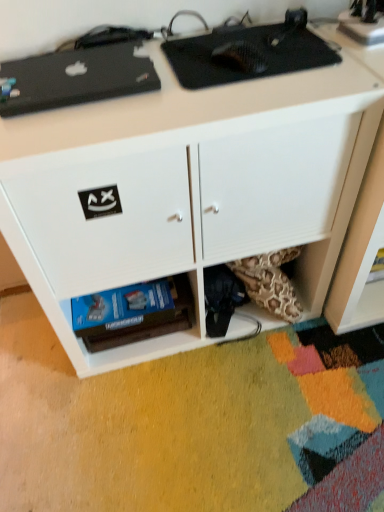
This screenshot has height=512, width=384. I want to click on vacant region in front of black carbon fiber mouse pad at upper center, the second appliance in the right-to-left sequence, so click(x=249, y=99).